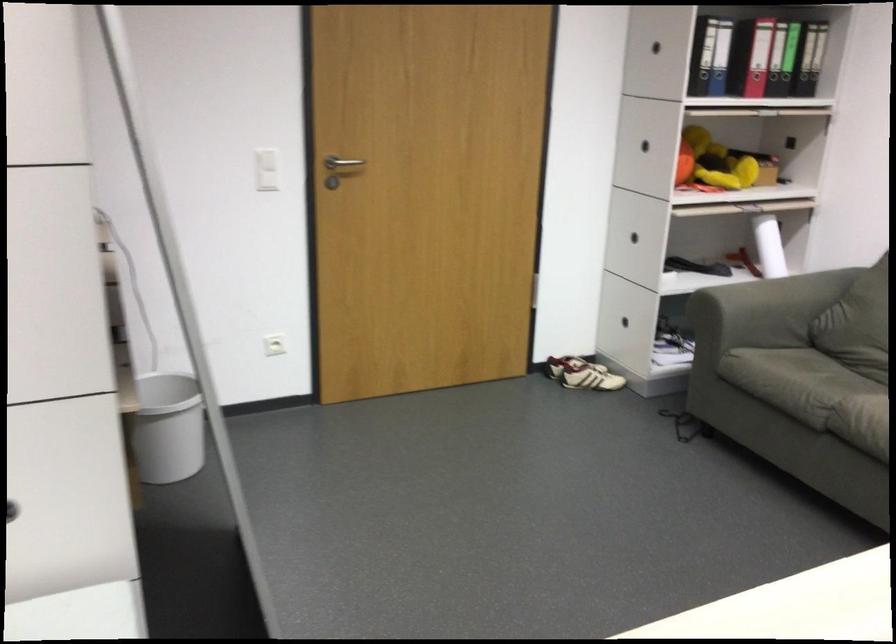
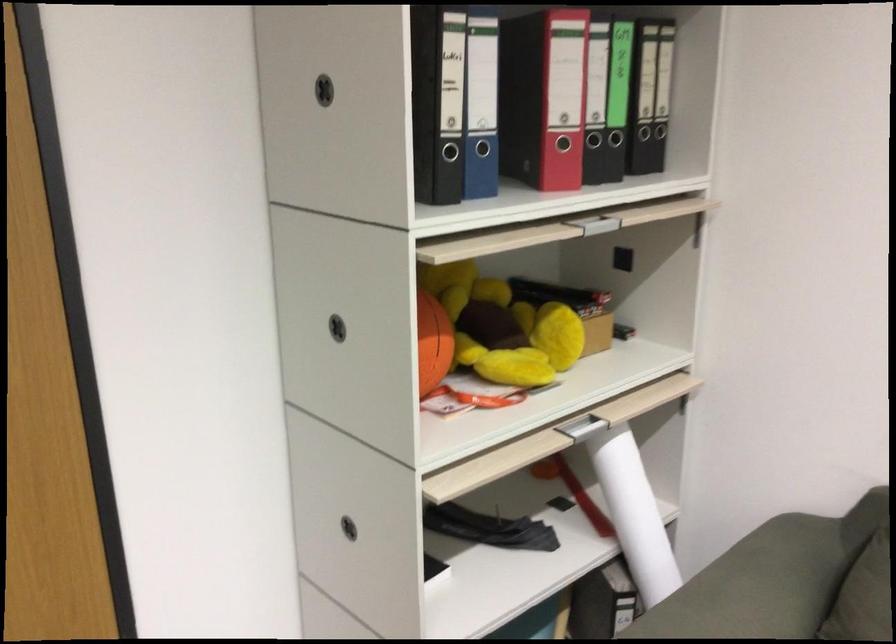
Find the pixel in the second image that matches pixel 634 135 in the first image.

(337, 328)